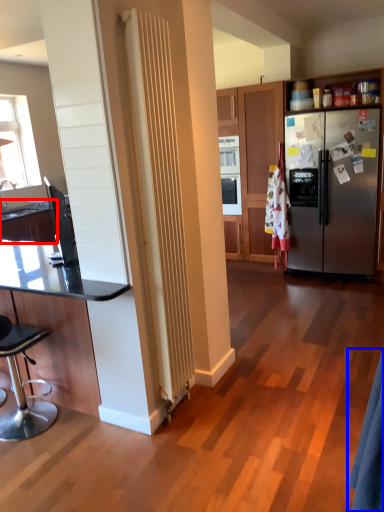
Question: Among these objects, which one is nearest to the camera, countertop (highlighted by a red box) or robe (highlighted by a blue box)?

Choices:
 (A) countertop
 (B) robe

Answer: (B)